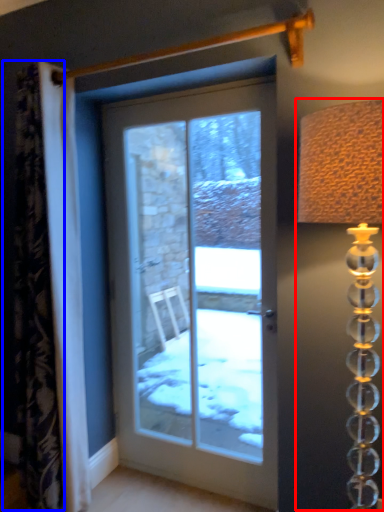
Question: Among these objects, which one is nearest to the camera, table lamp (highlighted by a red box) or curtain (highlighted by a blue box)?

Choices:
 (A) table lamp
 (B) curtain

Answer: (A)